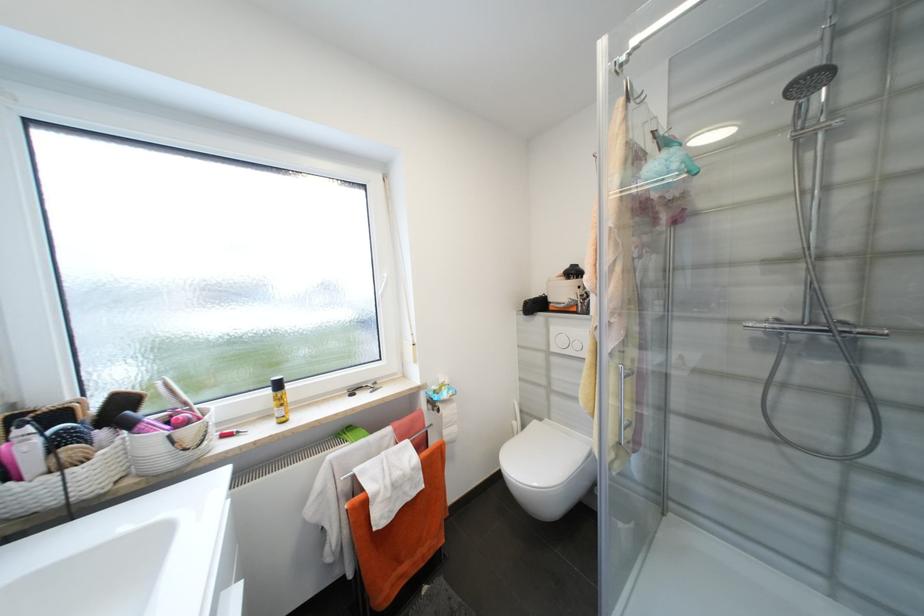
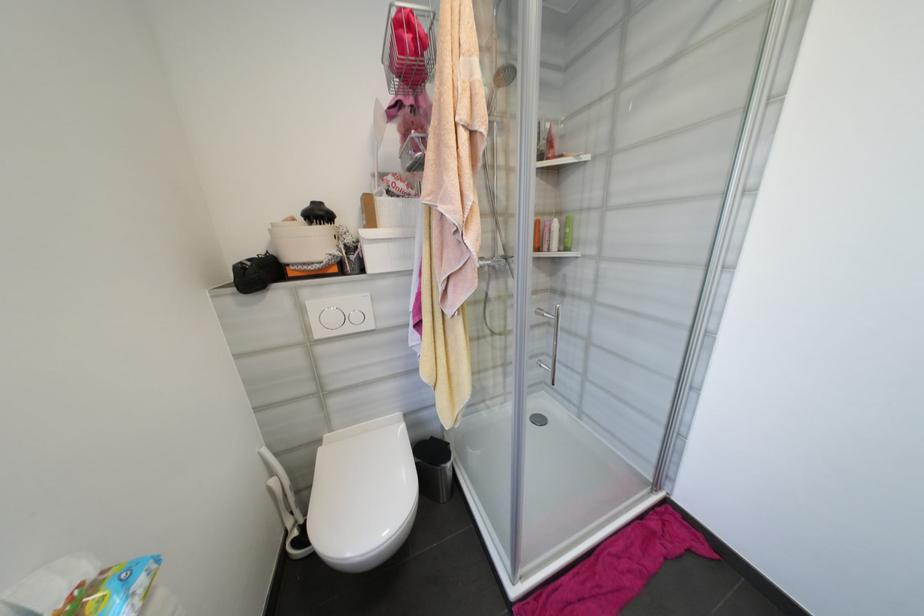
In the second image, find the point that corresponds to pixel 520 424 in the first image.

(277, 482)